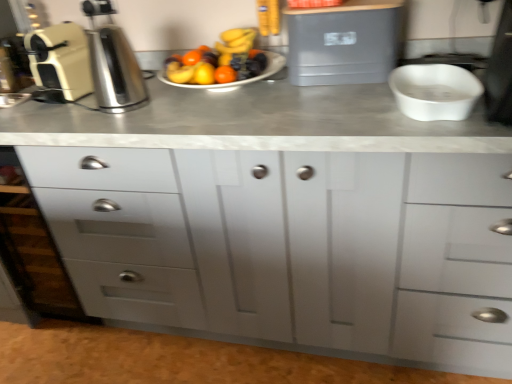
Locate an element on the screen. vacant space that's between white glossy mixing bowl at right and gray plastic container at upper center, the second appliance in the left-to-right sequence is located at coordinates (339, 97).